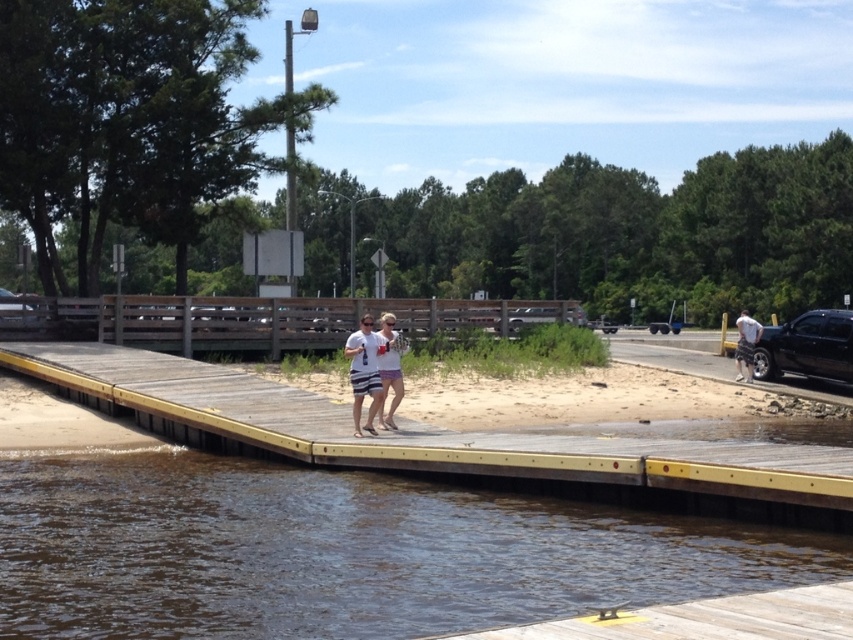
Question: Does wooden dock at center have a greater width compared to black glossy truck at right?

Choices:
 (A) yes
 (B) no

Answer: (B)

Question: Which of the following is the closest to the observer?

Choices:
 (A) wooden dock at center
 (B) matte black truck at center

Answer: (A)

Question: Which object is farther from the camera taking this photo?

Choices:
 (A) wooden dock at center
 (B) matte black truck at center

Answer: (B)

Question: Is brown water at lower left smaller than black glossy truck at right?

Choices:
 (A) yes
 (B) no

Answer: (A)

Question: Is brown water at lower left above white cotton shirt at right?

Choices:
 (A) no
 (B) yes

Answer: (A)

Question: Which of the following is the closest to the observer?

Choices:
 (A) black glossy truck at right
 (B) brown water at lower left
 (C) white cotton t-shirt at center
 (D) matte black truck at center

Answer: (B)